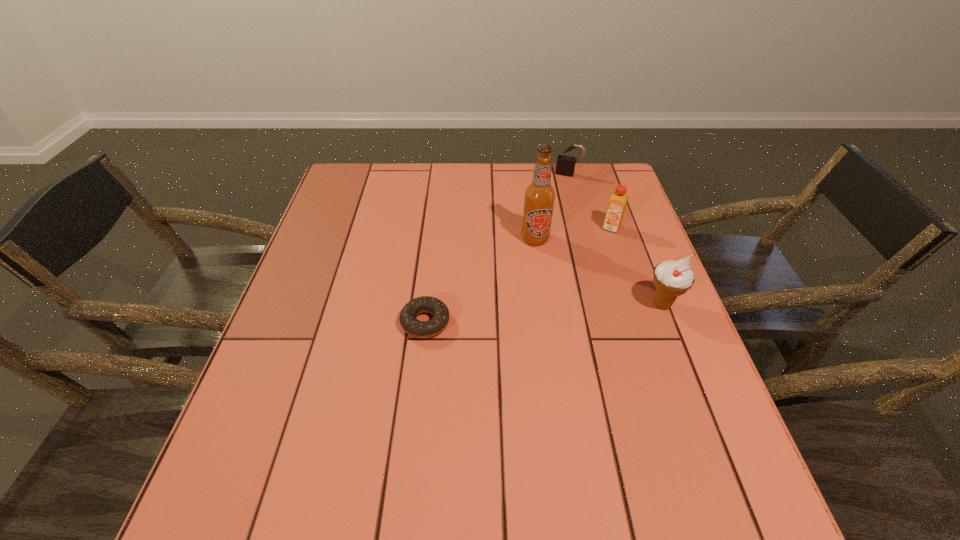
The width and height of the screenshot is (960, 540). I want to click on vacant spot on the desktop that is between the doughnut and the icecream and is positioned on the front and back of the orange juice, so 579,310.

Locate an element on the screen. This screenshot has height=540, width=960. vacant space on the desktop that is between the shortest object and the icecream and is positioned with the keyhole on the front of the second shortest object is located at coordinates (524, 315).

This screenshot has height=540, width=960. What are the coordinates of `free space on the desktop that is between the doughnut and the icecream and is positioned on the front label of the beer bottle` in the screenshot? It's located at (536, 314).